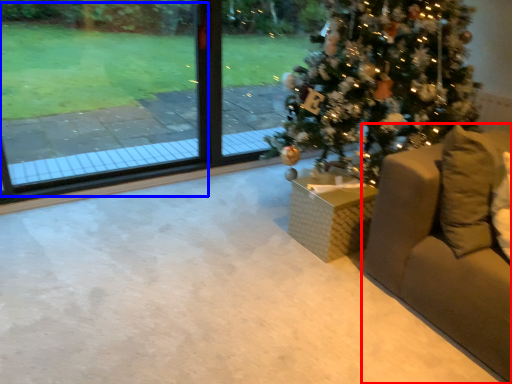
Question: Which object appears closest to the camera in this image, furniture (highlighted by a red box) or window screen (highlighted by a blue box)?

Choices:
 (A) furniture
 (B) window screen

Answer: (A)